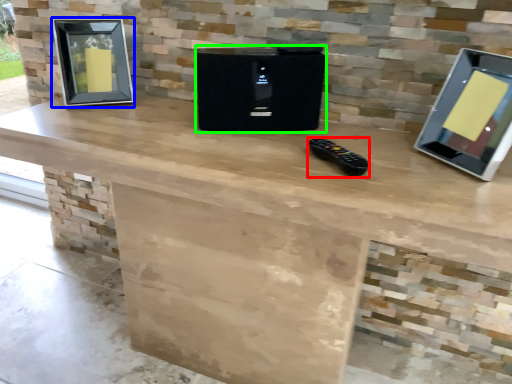
Question: Estimate the real-world distances between objects in this image. Which object is closer to game controller (highlighted by a red box), picture frame (highlighted by a blue box) or appliance (highlighted by a green box)?

Choices:
 (A) picture frame
 (B) appliance

Answer: (B)